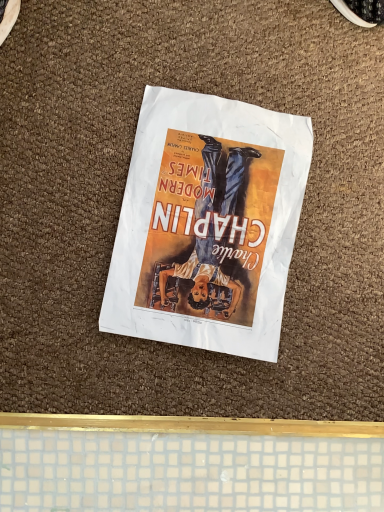
Describe the element at coordinates (208, 223) in the screenshot. The image size is (384, 512). I see `matte paper poster at center` at that location.

This screenshot has height=512, width=384. I want to click on matte paper poster at center, so click(x=208, y=223).

The height and width of the screenshot is (512, 384). Find the location of `matte paper poster at center`. matte paper poster at center is located at coordinates (208, 223).